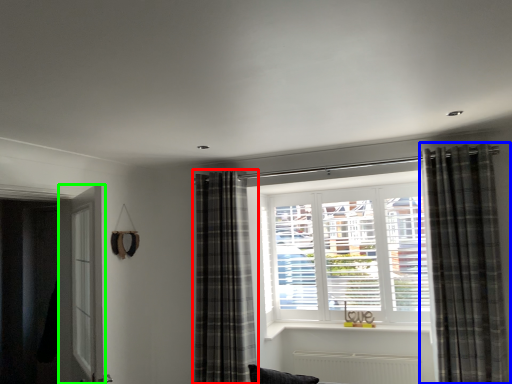
Question: Which object is the farthest from curtain (highlighted by a red box)? Choose among these: curtain (highlighted by a blue box) or screen door (highlighted by a green box).

Choices:
 (A) curtain
 (B) screen door

Answer: (A)